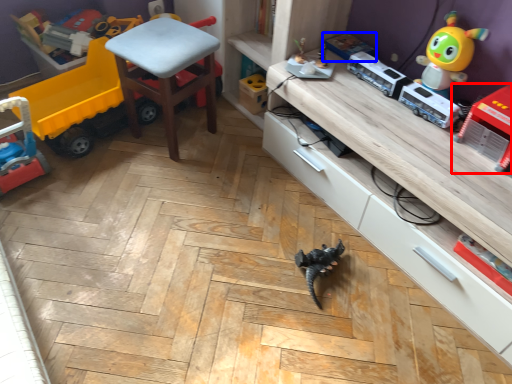
Question: Which point is closer to the camera, toy (highlighted by a red box) or toy (highlighted by a blue box)?

Choices:
 (A) toy
 (B) toy

Answer: (A)